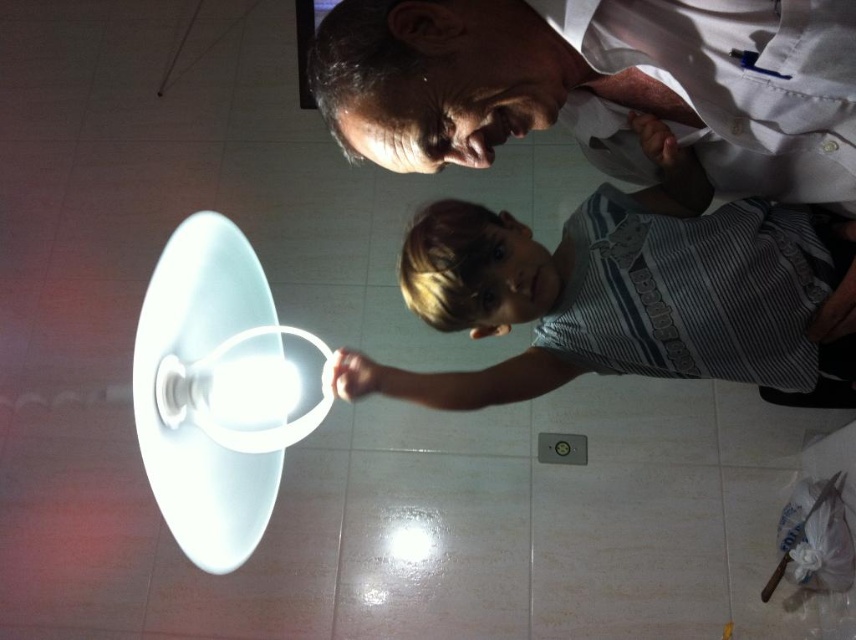
Question: Which point is closer to the camera taking this photo?

Choices:
 (A) (696, 106)
 (B) (203, 273)

Answer: (A)

Question: Which object is positioned farthest from the white glossy lampshade at lower left?

Choices:
 (A) striped cotton shirt at center
 (B) white shirt at upper center

Answer: (B)

Question: Can you confirm if white shirt at upper center is positioned to the left of white glossy lampshade at lower left?

Choices:
 (A) yes
 (B) no

Answer: (B)

Question: Is the position of white shirt at upper center more distant than that of white glossy lampshade at lower left?

Choices:
 (A) no
 (B) yes

Answer: (A)

Question: Which point is closer to the camera taking this photo?

Choices:
 (A) (153, 289)
 (B) (412, 150)
 (C) (575, 369)

Answer: (B)

Question: Is white shirt at upper center wider than striped cotton shirt at center?

Choices:
 (A) yes
 (B) no

Answer: (B)